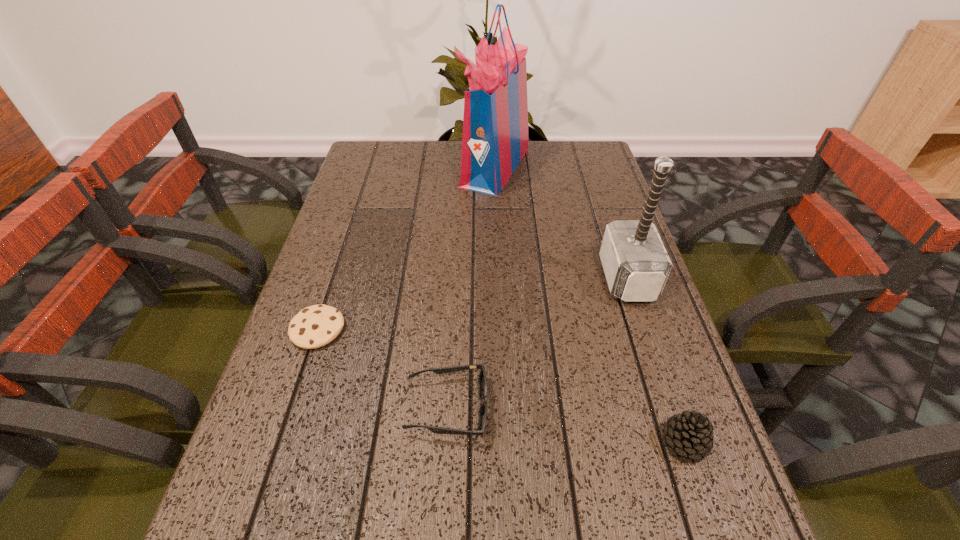
The width and height of the screenshot is (960, 540). Identify the location of vacant space located on the front-facing side of the tallest object. (352, 166).

Locate an element on the screen. Image resolution: width=960 pixels, height=540 pixels. free spot located 0.350m for striking with the head of the hammer is located at coordinates (453, 278).

The width and height of the screenshot is (960, 540). What are the coordinates of `vacant space located for striking with the head of the hammer` in the screenshot? It's located at (462, 278).

At what (x,y) coordinates should I click in order to perform the action: click on vacant space located 0.330m for striking with the head of the hammer. Please return your answer as a coordinate pair (x, y). Looking at the image, I should click on (462, 278).

This screenshot has height=540, width=960. What are the coordinates of `vacant space located 0.210m at the narrow end of the third shortest object` in the screenshot? It's located at (538, 442).

Locate an element on the screen. This screenshot has height=540, width=960. vacant space located 0.330m at the narrow end of the third shortest object is located at coordinates (467, 442).

Where is `free spot located 0.160m at the narrow end of the third shortest object`? free spot located 0.160m at the narrow end of the third shortest object is located at coordinates (567, 442).

Locate an element on the screen. Image resolution: width=960 pixels, height=540 pixels. free space located 0.130m on the front-facing side of the sunglasses is located at coordinates pyautogui.click(x=560, y=408).

Where is `vacant space located on the right of the leftmost object`? The height and width of the screenshot is (540, 960). vacant space located on the right of the leftmost object is located at coordinates 517,329.

Locate an element on the screen. object at the far edge is located at coordinates (495, 125).